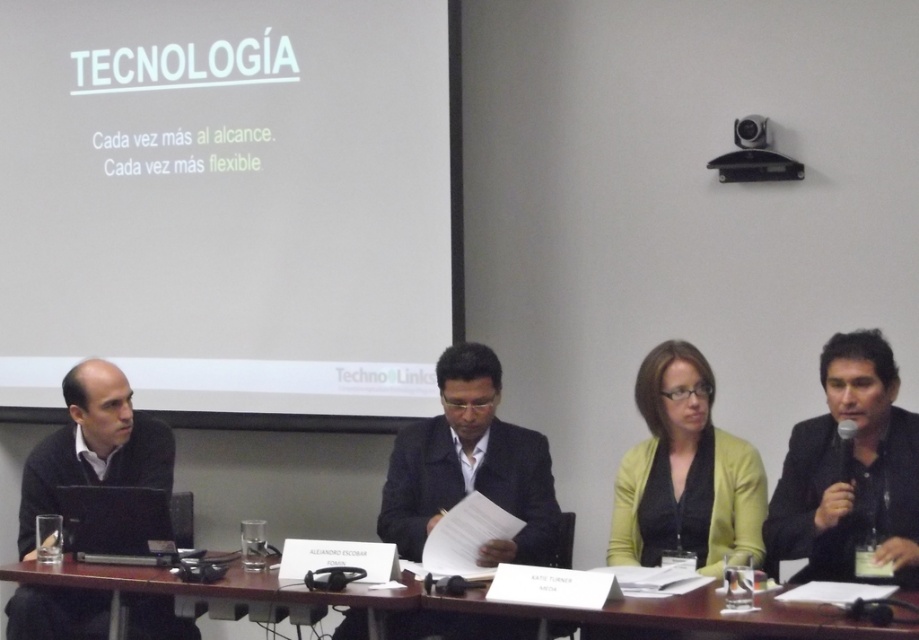
You are standing at the back of the room facing the table. Which of the two points, point [789,522] or point [111,490], is closer to you?

Point [111,490] is closer to you because it is behind point [789,522].

You are sitting at the back of the room and need to reach the black matte laptop at left and the black matte jacket at right. Which object is closer to you?

The black matte laptop at left is closer to you because it is only 2.27 meters away from the black matte jacket at right, so if you are at the back, the laptop is nearer.

You are standing at the front of the room facing the table. Which of the two points, point (349, 586) or point (702, 602), is closer to you?

Point (702, 602) is closer to you because it is in front of point (349, 586).